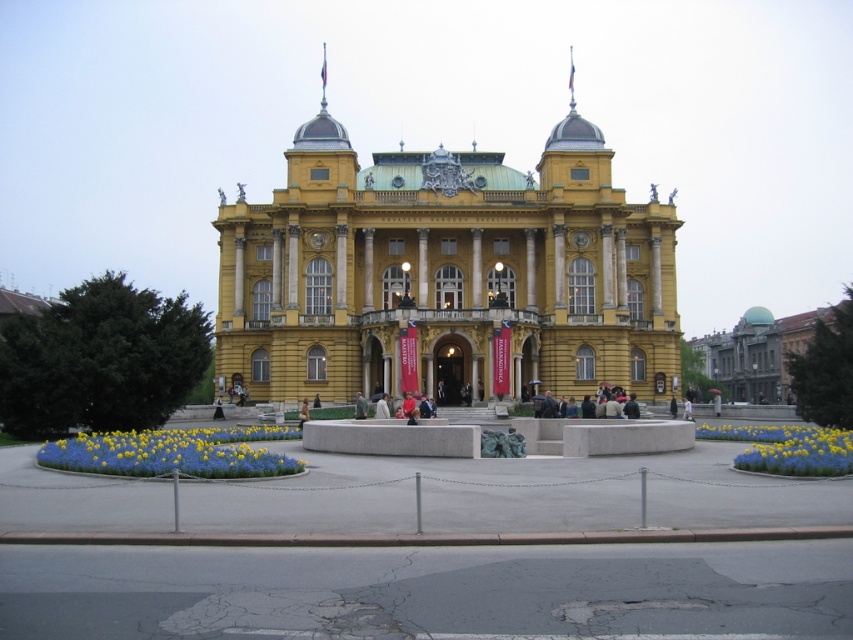
You are standing in the plaza in front of the grand building. You see the dark gray stone building at center and the dark gray fabric jacket at center. Which object is bigger?

The dark gray stone building at center is larger in size than the dark gray fabric jacket at center.

You are standing in the plaza in front of the grand building. You see two points marked on the facade of the building. One is at point coordinates point (x=759, y=369) and the other is at point coordinates point (x=613, y=390). Which point is closer to you?

Point (x=613, y=390) is closer to you because it is less further to the camera than point (x=759, y=369).

You are standing in front of the yellow stone building at center. If you want to take a photo of the entire building without any cropping, would the distance you are currently at be sufficient? Please explain your reasoning based on the building size and your position.

The yellow stone building at center is 96.39 meters away from the camera. Since the building is grand and ornate with classical architectural features like towers and domed roofs, this distance should allow capturing the entire structure in one frame without cropping, assuming a standard wide angle lens is used.